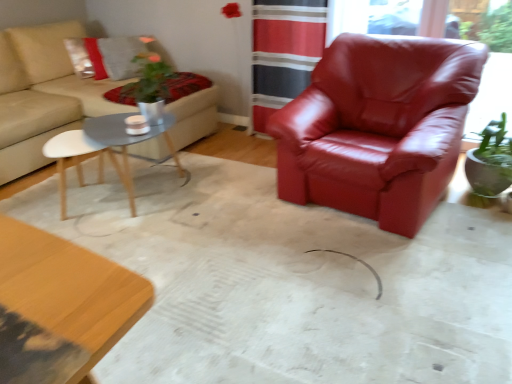
Question: Does matte gray wood coffee table at center-left have a greater height compared to glossy leather armchair at right?

Choices:
 (A) no
 (B) yes

Answer: (A)

Question: Considering the relative sizes of matte gray wood coffee table at center-left and glossy leather armchair at right in the image provided, is matte gray wood coffee table at center-left wider than glossy leather armchair at right?

Choices:
 (A) yes
 (B) no

Answer: (A)

Question: Is matte gray wood coffee table at center-left directly adjacent to glossy leather armchair at right?

Choices:
 (A) yes
 (B) no

Answer: (B)

Question: Can you confirm if matte gray wood coffee table at center-left is smaller than glossy leather armchair at right?

Choices:
 (A) yes
 (B) no

Answer: (B)

Question: Considering the relative sizes of matte gray wood coffee table at center-left and glossy leather armchair at right in the image provided, is matte gray wood coffee table at center-left shorter than glossy leather armchair at right?

Choices:
 (A) no
 (B) yes

Answer: (B)

Question: From their relative heights in the image, would you say beige fabric couch at upper left is taller or shorter than glossy leather armchair at right?

Choices:
 (A) short
 (B) tall

Answer: (A)

Question: Considering their positions, is beige fabric couch at upper left located in front of or behind glossy leather armchair at right?

Choices:
 (A) front
 (B) behind

Answer: (B)

Question: From a real-world perspective, is beige fabric couch at upper left above or below glossy leather armchair at right?

Choices:
 (A) above
 (B) below

Answer: (B)

Question: Based on their positions, is beige fabric couch at upper left located to the left or right of glossy leather armchair at right?

Choices:
 (A) right
 (B) left

Answer: (B)

Question: Is beige fabric couch at upper left spatially inside matte gray wood coffee table at center-left, or outside of it?

Choices:
 (A) outside
 (B) inside

Answer: (A)

Question: Is point (34, 86) positioned closer to the camera than point (130, 206)?

Choices:
 (A) closer
 (B) farther

Answer: (B)

Question: From the image's perspective, is beige fabric couch at upper left positioned above or below matte gray wood coffee table at center-left?

Choices:
 (A) below
 (B) above

Answer: (B)

Question: Considering the positions of beige fabric couch at upper left and matte gray wood coffee table at center-left in the image, is beige fabric couch at upper left wider or thinner than matte gray wood coffee table at center-left?

Choices:
 (A) thin
 (B) wide

Answer: (B)

Question: In terms of height, does velvet red blanket at upper left look taller or shorter compared to beige fabric couch at upper left?

Choices:
 (A) short
 (B) tall

Answer: (A)

Question: Considering the positions of point (184, 72) and point (181, 104), is point (184, 72) closer or farther from the camera than point (181, 104)?

Choices:
 (A) farther
 (B) closer

Answer: (A)